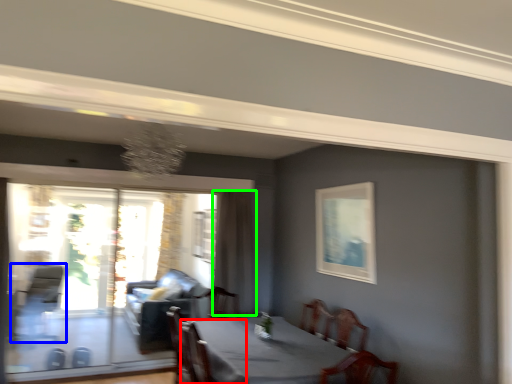
Question: Based on their relative distances, which object is nearer to armchair (highlighted by a red box)? Choose from armchair (highlighted by a blue box) and curtain (highlighted by a green box).

Choices:
 (A) armchair
 (B) curtain

Answer: (B)